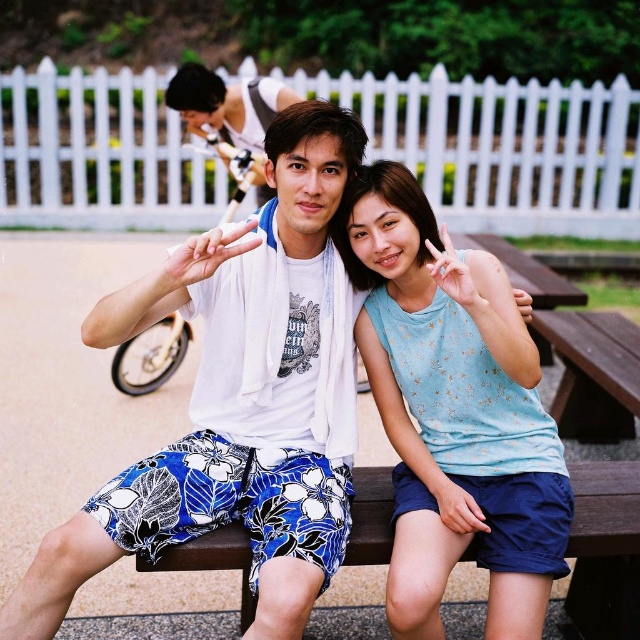
Please look at the image. There are two people sitting on a wooden bench. The person on the left is wearing a white t shirt with a graphic design and blue shorts with floral patterns, and the person on the right is wearing a light blue sleeveless top with star patterns and dark blue shorts. Where exactly is the light blue fabric tank top at center located in the image?

The light blue fabric tank top at center is located at point coordinates of (452, 412).